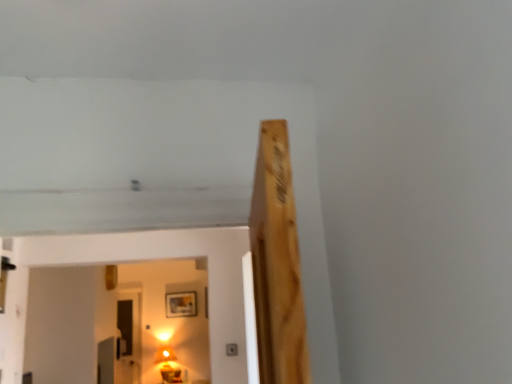
Question: From a real-world perspective, does transparent glass door at lower left sit lower than matte gold lamp at lower center?

Choices:
 (A) yes
 (B) no

Answer: (B)

Question: Considering the relative sizes of transparent glass door at lower left and matte gold lamp at lower center in the image provided, is transparent glass door at lower left taller than matte gold lamp at lower center?

Choices:
 (A) yes
 (B) no

Answer: (A)

Question: Does transparent glass door at lower left have a larger size compared to matte gold lamp at lower center?

Choices:
 (A) yes
 (B) no

Answer: (B)

Question: Is transparent glass door at lower left positioned far away from matte gold lamp at lower center?

Choices:
 (A) no
 (B) yes

Answer: (A)

Question: Considering the relative sizes of transparent glass door at lower left and matte gold lamp at lower center in the image provided, is transparent glass door at lower left shorter than matte gold lamp at lower center?

Choices:
 (A) no
 (B) yes

Answer: (A)

Question: Is the surface of transparent glass door at lower left in direct contact with matte gold lamp at lower center?

Choices:
 (A) no
 (B) yes

Answer: (A)

Question: Does wooden picture frame at upper center lie behind matte gold lamp at lower center?

Choices:
 (A) no
 (B) yes

Answer: (B)

Question: Can you confirm if wooden picture frame at upper center is taller than matte gold lamp at lower center?

Choices:
 (A) yes
 (B) no

Answer: (B)

Question: From a real-world perspective, is wooden picture frame at upper center on top of matte gold lamp at lower center?

Choices:
 (A) no
 (B) yes

Answer: (B)

Question: From a real-world perspective, does wooden picture frame at upper center sit lower than matte gold lamp at lower center?

Choices:
 (A) no
 (B) yes

Answer: (A)

Question: Is wooden picture frame at upper center in front of matte gold lamp at lower center?

Choices:
 (A) yes
 (B) no

Answer: (B)

Question: Are wooden picture frame at upper center and matte gold lamp at lower center making contact?

Choices:
 (A) yes
 (B) no

Answer: (B)

Question: Considering the relative positions of matte gold lamp at lower center and wooden picture frame at upper center in the image provided, is matte gold lamp at lower center to the right of wooden picture frame at upper center from the viewer's perspective?

Choices:
 (A) no
 (B) yes

Answer: (A)